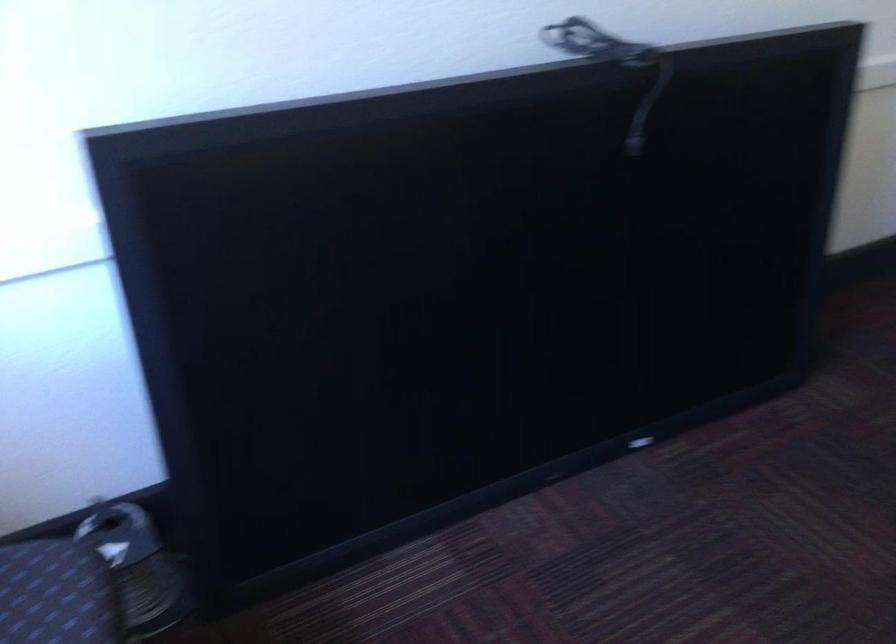
Find where to plugg the black power plug. Please return your answer as a coordinate pair (x, y).

(613, 64)